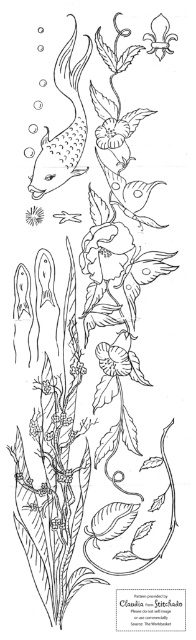
Question: Is white paper flower at upper center in front of matte black flower at upper left?

Choices:
 (A) no
 (B) yes

Answer: (B)

Question: Among these points, which one is nearest to the camera?

Choices:
 (A) (157, 22)
 (B) (36, 218)
 (C) (77, 74)

Answer: (A)

Question: In this image, where is matte black fish at upper left located relative to white paper flower at upper center?

Choices:
 (A) above
 (B) below

Answer: (B)

Question: Observing the image, what is the correct spatial positioning of matte black fish at upper left in reference to white paper flower at upper center?

Choices:
 (A) left
 (B) right

Answer: (A)

Question: Which object is the farthest from the white paper flower at upper center?

Choices:
 (A) matte black flower at upper left
 (B) matte black fish at upper left

Answer: (A)

Question: Which of the following is the closest to the observer?

Choices:
 (A) matte black flower at upper left
 (B) white paper flower at upper center
 (C) matte black fish at upper left

Answer: (B)